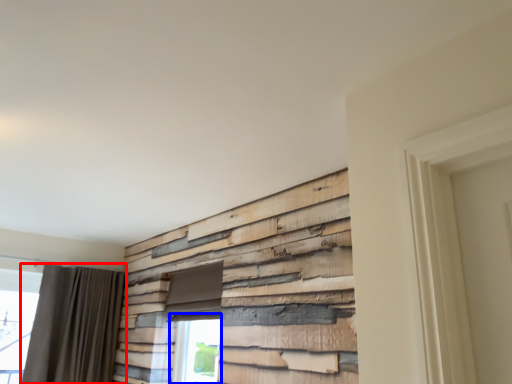
Question: Which object appears closest to the camera in this image, curtain (highlighted by a red box) or window (highlighted by a blue box)?

Choices:
 (A) curtain
 (B) window

Answer: (B)